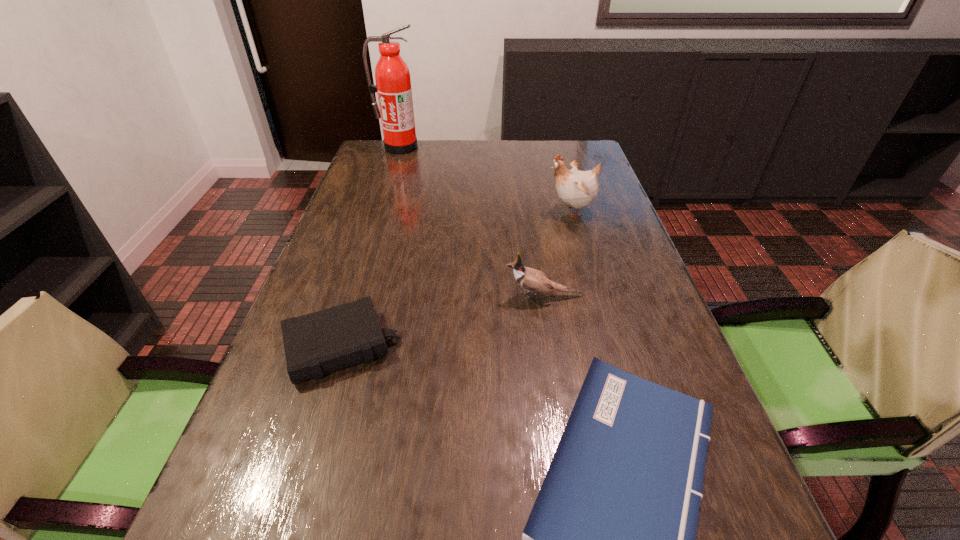
Locate an element on the screen. vacant point located between the farthest object and the fourth shortest object is located at coordinates (486, 179).

Where is `object that stands as the fourth closest to the farthest object`? object that stands as the fourth closest to the farthest object is located at coordinates (610, 539).

This screenshot has height=540, width=960. I want to click on object that is the second nearest to the tallest object, so click(x=533, y=280).

I want to click on vacant space that satisfies the following two spatial constraints: 1. on the label side of the fourth tallest object; 2. on the right side of the tallest object, so click(336, 346).